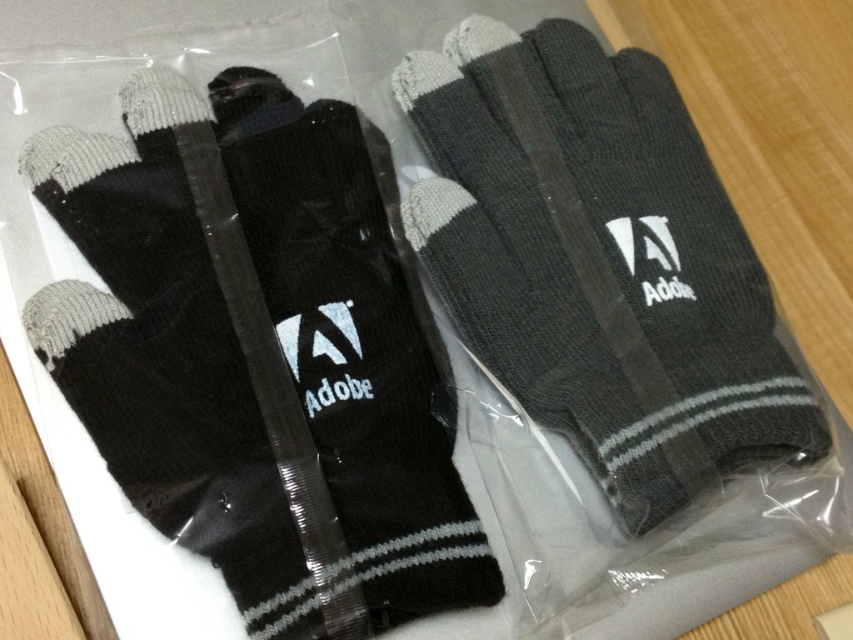
You are organizing gloves in a drawer and have two pairs in front of you. You need to place the wider pair first. Which pair should you choose between the black knitted gloves at center and the dark gray knitted glove at center?

The black knitted gloves at center are wider than the dark gray knitted glove at center, so you should place the black knitted gloves at center first.

You are organizing a workshop and need to place two pairs of gloves side by side on a table. The black knitted gloves at center and the dark gray knitted glove at center are available. According to the image, which pair should be placed on the left to maintain the correct arrangement?

The black knitted gloves at center should be placed on the left since they are positioned on the left side of the dark gray knitted glove at center in the image.